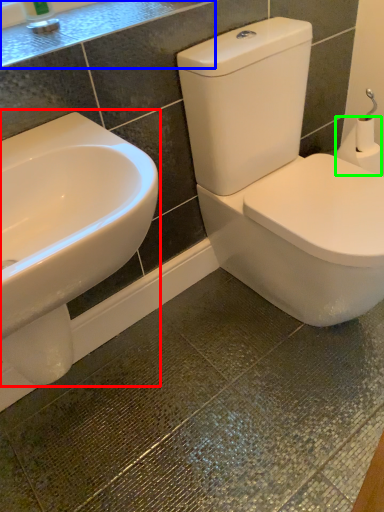
Question: Estimate the real-world distances between objects in this image. Which object is farther from sink (highlighted by a red box), counter top (highlighted by a blue box) or toilet paper (highlighted by a green box)?

Choices:
 (A) counter top
 (B) toilet paper

Answer: (B)